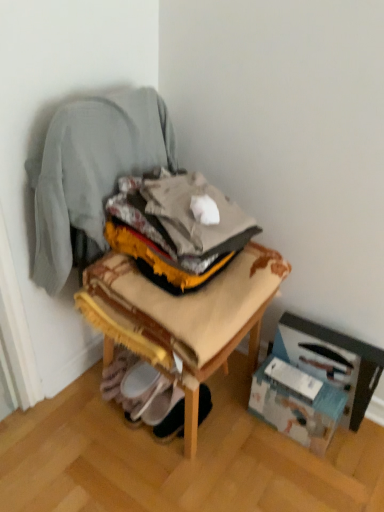
Question: From a real-world perspective, is wooden stool at center on top of white cardboard box at lower right, marked as the 2th cardboard box in a left-to-right arrangement?

Choices:
 (A) yes
 (B) no

Answer: (A)

Question: Is the depth of wooden stool at center less than that of white cardboard box at lower right, which appears as the first cardboard box when viewed from the right?

Choices:
 (A) yes
 (B) no

Answer: (A)

Question: Is wooden stool at center beside white cardboard box at lower right, marked as the 2th cardboard box in a left-to-right arrangement?

Choices:
 (A) yes
 (B) no

Answer: (B)

Question: Is wooden stool at center facing towards white cardboard box at lower right, marked as the 2th cardboard box in a left-to-right arrangement?

Choices:
 (A) yes
 (B) no

Answer: (B)

Question: Is wooden stool at center far away from white cardboard box at lower right, which appears as the first cardboard box when viewed from the right?

Choices:
 (A) yes
 (B) no

Answer: (B)

Question: From the image's perspective, is wooden stool at center on white cardboard box at lower right, which appears as the first cardboard box when viewed from the right?

Choices:
 (A) yes
 (B) no

Answer: (A)

Question: Is wooden chair at center further to the viewer compared to white fabric shoe at lower center?

Choices:
 (A) no
 (B) yes

Answer: (A)

Question: Can you confirm if wooden chair at center is thinner than white fabric shoe at lower center?

Choices:
 (A) no
 (B) yes

Answer: (A)

Question: From a real-world perspective, is wooden chair at center located higher than white fabric shoe at lower center?

Choices:
 (A) no
 (B) yes

Answer: (B)

Question: From the image's perspective, does wooden chair at center appear lower than white fabric shoe at lower center?

Choices:
 (A) no
 (B) yes

Answer: (A)

Question: From a real-world perspective, is wooden chair at center beneath white fabric shoe at lower center?

Choices:
 (A) yes
 (B) no

Answer: (B)

Question: Is the depth of wooden chair at center less than that of white fabric shoe at lower center?

Choices:
 (A) yes
 (B) no

Answer: (A)

Question: From a real-world perspective, is wooden stool at center positioned over white fabric shoe at lower center based on gravity?

Choices:
 (A) yes
 (B) no

Answer: (A)